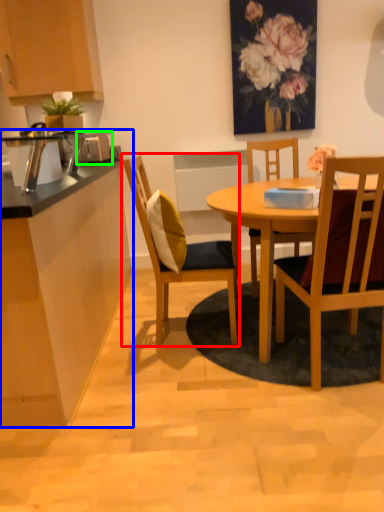
Question: Which object is the closest to the chair (highlighted by a red box)? Choose among these: desk (highlighted by a blue box) or appliance (highlighted by a green box).

Choices:
 (A) desk
 (B) appliance

Answer: (A)